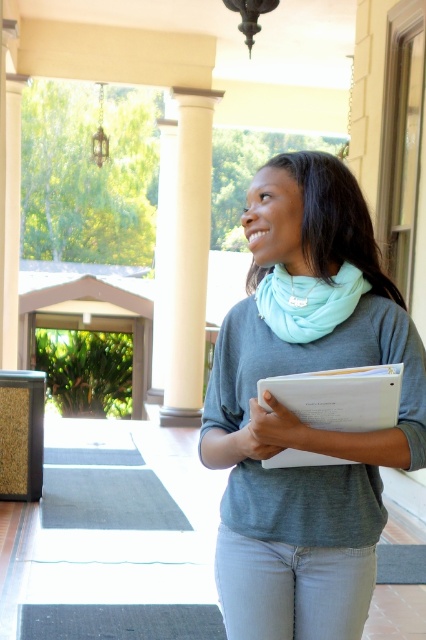
Who is more forward, (210, 100) or (313, 284)?

Point (313, 284) is in front.

Who is positioned more to the right, white smooth column at center or tiffany blue soft scarf at center?

Positioned to the right is tiffany blue soft scarf at center.

Is point (192, 221) positioned behind point (276, 314)?

Yes, point (192, 221) is behind point (276, 314).

Locate an element on the screen. The width and height of the screenshot is (426, 640). white smooth column at center is located at coordinates (189, 259).

Is gray matte scarf at center taller than tiffany blue soft scarf at center?

Correct, gray matte scarf at center is much taller as tiffany blue soft scarf at center.

Between gray matte scarf at center and tiffany blue soft scarf at center, which one is positioned higher?

tiffany blue soft scarf at center is above.

Is point (377, 296) positioned in front of point (350, 294)?

No.

Identify the location of gray matte scarf at center. Image resolution: width=426 pixels, height=640 pixels. (299, 419).

The height and width of the screenshot is (640, 426). What do you see at coordinates (339, 396) in the screenshot?
I see `white paper clipboard at center` at bounding box center [339, 396].

What do you see at coordinates (339, 396) in the screenshot? I see `white paper clipboard at center` at bounding box center [339, 396].

At what (x,y) coordinates should I click in order to perform the action: click on white paper clipboard at center. Please return your answer as a coordinate pair (x, y). The height and width of the screenshot is (640, 426). Looking at the image, I should click on (339, 396).